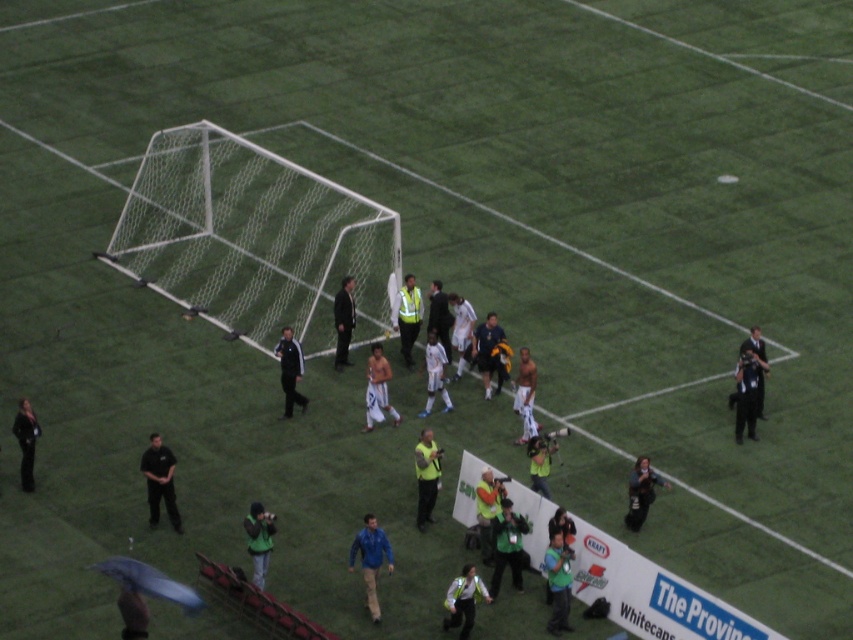
From the picture: You are standing at the center of the soccer field and see the green fabric jacket at lower right. Which direction should you walk to reach it?

The green fabric jacket at lower right is located at point 0.770 on the x and 0.751 on the y coordinate. Since you are at the center, you should walk towards the lower right direction to reach it.

You are a photographer positioned at the edge of the soccer field. You want to take a photo that includes both the white mesh net at center and the black smooth suit at center. Based on their positions, which object should you adjust your camera to focus on first to ensure both are in the frame?

The white mesh net at center is to the right of the black smooth suit at center. To include both in the frame, you should first focus on the black smooth suit at center, as it is on the left, and then adjust the camera to include the white mesh net at center on the right.